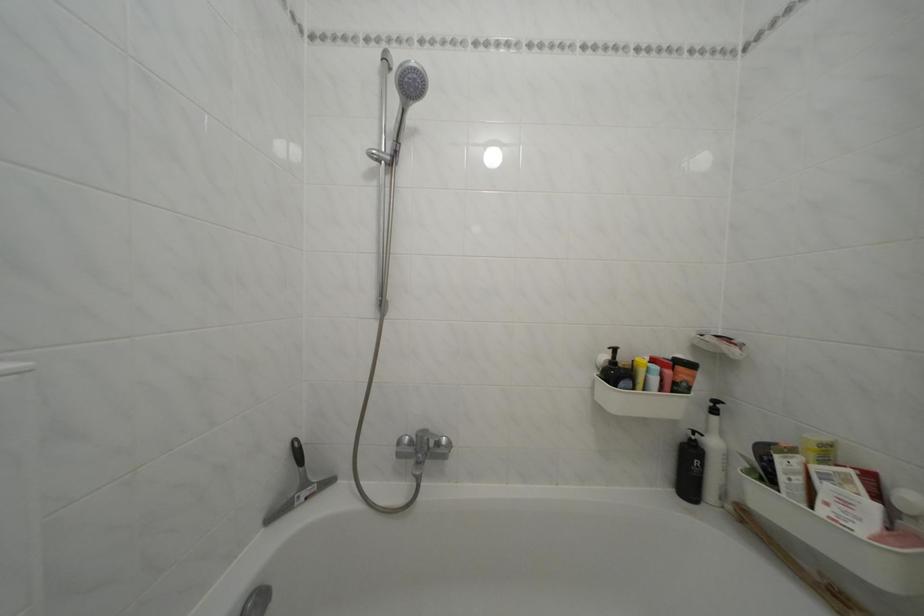
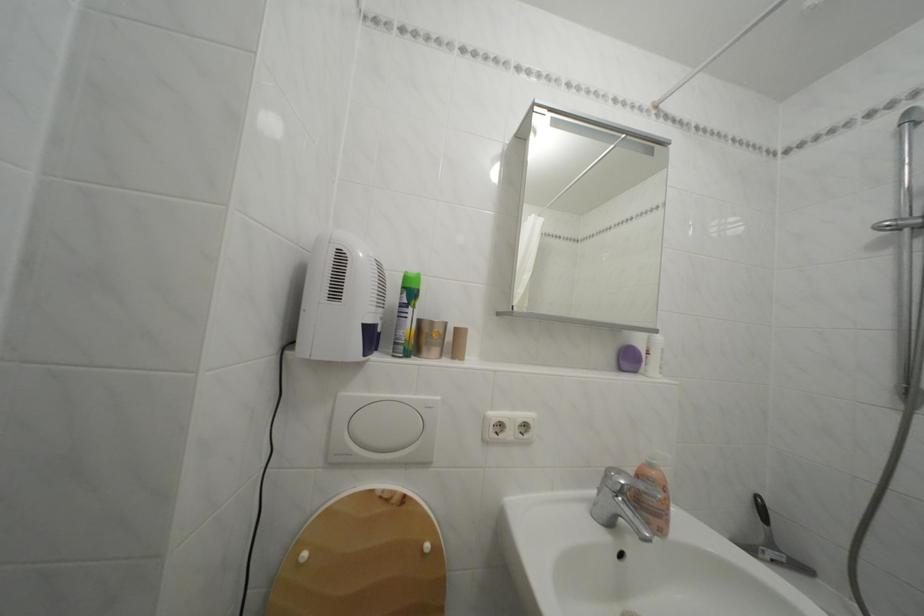
Question: The first image is from the beginning of the video and the second image is from the end. How did the camera likely rotate when shooting the video?

Choices:
 (A) Left
 (B) Right
 (C) Up
 (D) Down

Answer: (A)